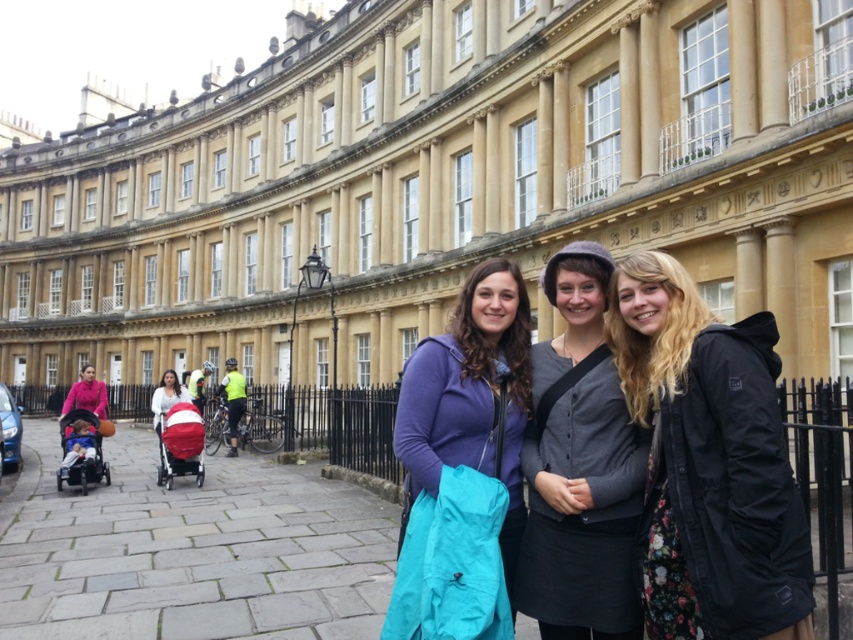
You are a photographer trying to capture the perfect shot of the black matte jacket at center in the scene. The camera you are using has a fixed focus point at coordinates 0.723, 0.832. Will the jacket be in focus?

Yes, the black matte jacket at center is exactly at the coordinates (709, 461), so it will be in focus.

You are a photographer standing in front of the classical building. You notice the gray matte cardigan at center and the red fabric baby carriage at left. Which object is positioned higher from the ground?

The gray matte cardigan at center is above the red fabric baby carriage at left, so it is positioned higher from the ground.